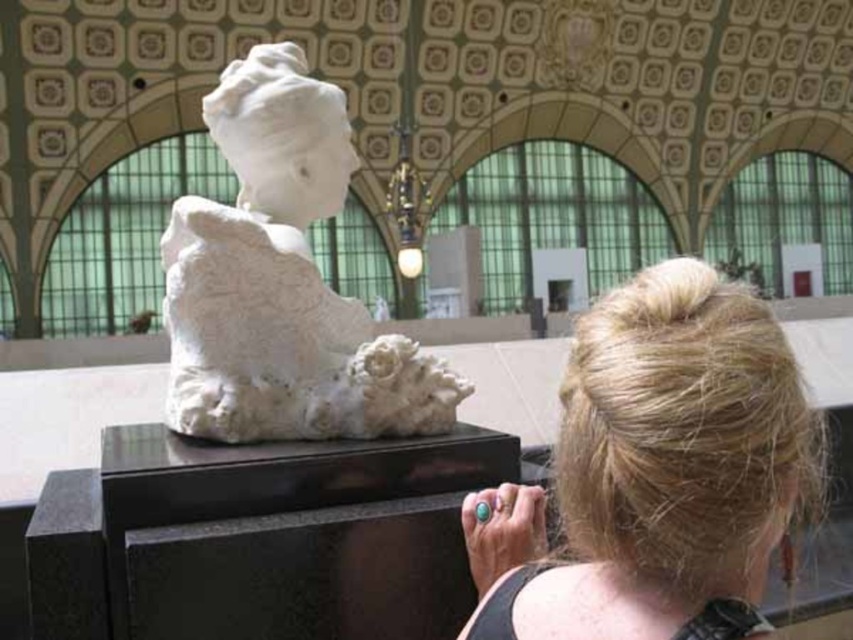
Who is taller, blonde hair at upper right or white marble sculpture at center?

Standing taller between the two is blonde hair at upper right.

Does point (587, 339) lie in front of point (302, 237)?

Yes, point (587, 339) is closer to viewer.

The width and height of the screenshot is (853, 640). Identify the location of blonde hair at upper right. (656, 472).

Locate an element on the screen. This screenshot has height=640, width=853. blonde hair at upper right is located at coordinates (656, 472).